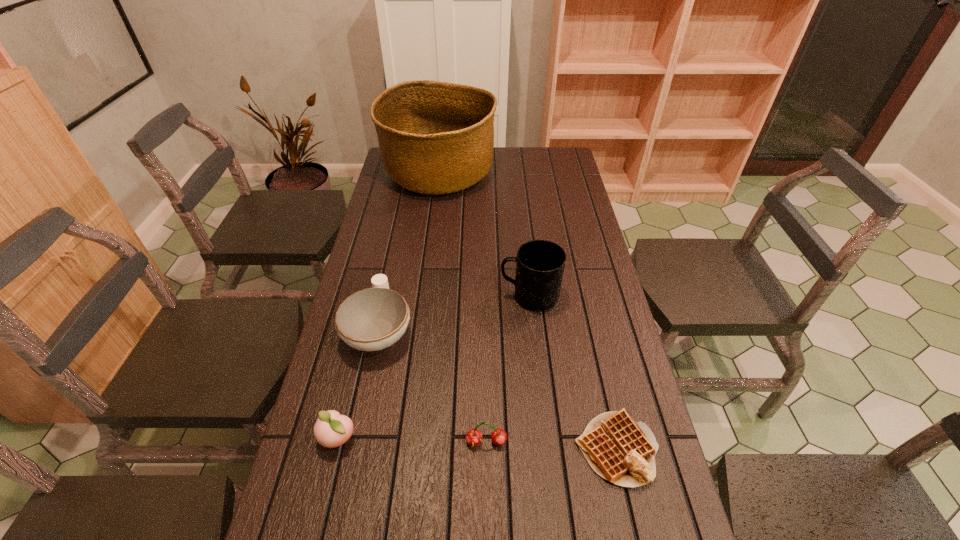
You are a GUI agent. You are given a task and a screenshot of the screen. Output one action in this format:
    pyautogui.click(x=<x>, y=<y>)
    Task: Click on the blank space that satisfies the following two spatial constraints: 1. on the side of the fifth shortest object with the handle; 2. with stems pointing upwards on the cherry
    The image size is (960, 540).
    Given the screenshot: What is the action you would take?
    point(545,442)

Locate an element on the screen. This screenshot has height=540, width=960. free location that satisfies the following two spatial constraints: 1. on the side of the second tallest object with the handle; 2. with stems pointing upwards on the cherry is located at coordinates (545, 442).